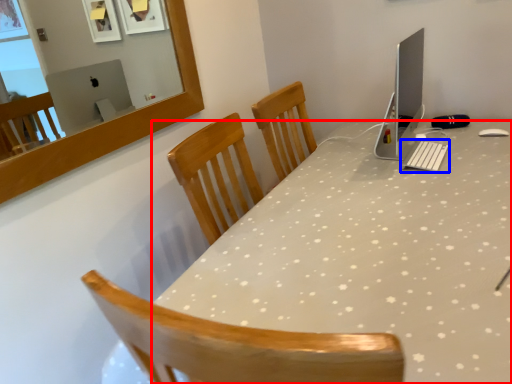
Question: Which object appears closest to the camera in this image, desk (highlighted by a red box) or keyboard (highlighted by a blue box)?

Choices:
 (A) desk
 (B) keyboard

Answer: (A)